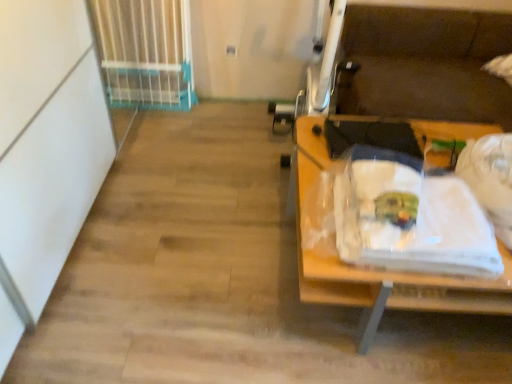
Question: Is white fabric at right positioned beyond the bounds of white plastic gate at upper left?

Choices:
 (A) no
 (B) yes

Answer: (B)

Question: Considering the relative sizes of white fabric at right and white plastic gate at upper left in the image provided, is white fabric at right wider than white plastic gate at upper left?

Choices:
 (A) no
 (B) yes

Answer: (B)

Question: Is white fabric at right positioned far away from white plastic gate at upper left?

Choices:
 (A) yes
 (B) no

Answer: (A)

Question: Can you confirm if white fabric at right is bigger than white plastic gate at upper left?

Choices:
 (A) no
 (B) yes

Answer: (A)

Question: Does white fabric at right have a greater height compared to white plastic gate at upper left?

Choices:
 (A) yes
 (B) no

Answer: (B)

Question: Would you say white fabric at right contains white plastic gate at upper left?

Choices:
 (A) no
 (B) yes

Answer: (A)

Question: Is the depth of white plastic gate at upper left greater than that of white fabric at right?

Choices:
 (A) no
 (B) yes

Answer: (B)

Question: Is white plastic gate at upper left positioned before white fabric at right?

Choices:
 (A) no
 (B) yes

Answer: (A)

Question: Is white plastic gate at upper left smaller than white fabric at right?

Choices:
 (A) no
 (B) yes

Answer: (A)

Question: Is white plastic gate at upper left directly adjacent to white fabric at right?

Choices:
 (A) no
 (B) yes

Answer: (A)

Question: Does white plastic gate at upper left have a lesser width compared to white fabric at right?

Choices:
 (A) yes
 (B) no

Answer: (A)

Question: Is white plastic gate at upper left taller than white fabric at right?

Choices:
 (A) no
 (B) yes

Answer: (B)

Question: From the image's perspective, is wooden desk at right on white plastic gate at upper left?

Choices:
 (A) yes
 (B) no

Answer: (B)